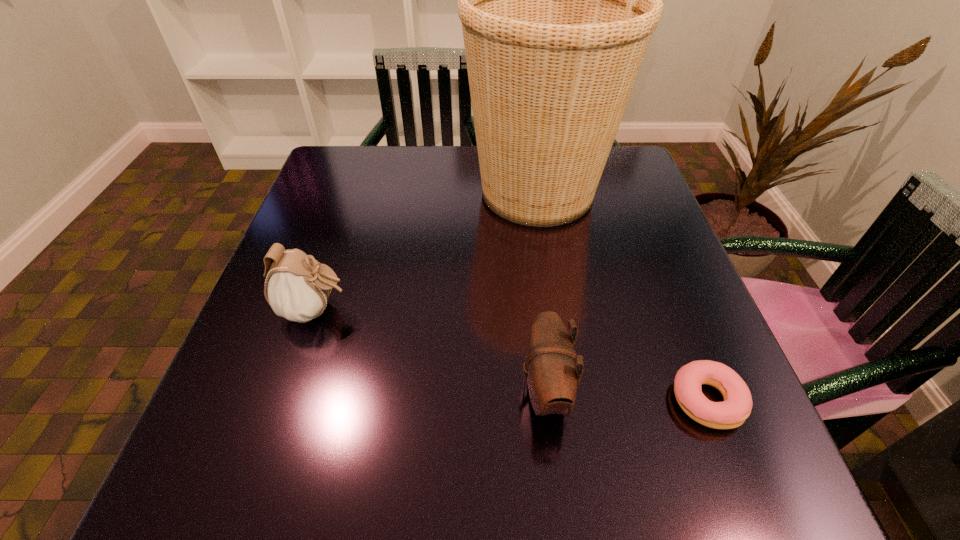
This screenshot has width=960, height=540. In the image, there is a desktop. In order to click on vacant space at the right edge in this screenshot , I will do `click(668, 412)`.

At what (x,y) coordinates should I click in order to perform the action: click on free space at the far left corner of the desktop. Please return your answer as a coordinate pair (x, y). Looking at the image, I should click on (389, 145).

In the image, there is a desktop. Identify the location of vacant space at the far right corner. The image size is (960, 540). (609, 166).

This screenshot has height=540, width=960. I want to click on free space between the basket and the nearer pouch, so click(541, 291).

I want to click on free space between the shortest object and the farther pouch, so click(511, 355).

In order to click on empty space between the right pouch and the tallest object in this screenshot , I will do `click(541, 291)`.

Where is `free area in between the basket and the nearer pouch`? free area in between the basket and the nearer pouch is located at coordinates (541, 291).

This screenshot has height=540, width=960. What are the coordinates of `vacant area that lies between the left pouch and the shortest object` in the screenshot? It's located at (511, 355).

At what (x,y) coordinates should I click in order to perform the action: click on free area in between the doughnut and the nearer pouch. Please return your answer as a coordinate pair (x, y). The image size is (960, 540). Looking at the image, I should click on (626, 395).

Where is `free space that is in between the second farthest object and the basket`? This screenshot has height=540, width=960. free space that is in between the second farthest object and the basket is located at coordinates (426, 251).